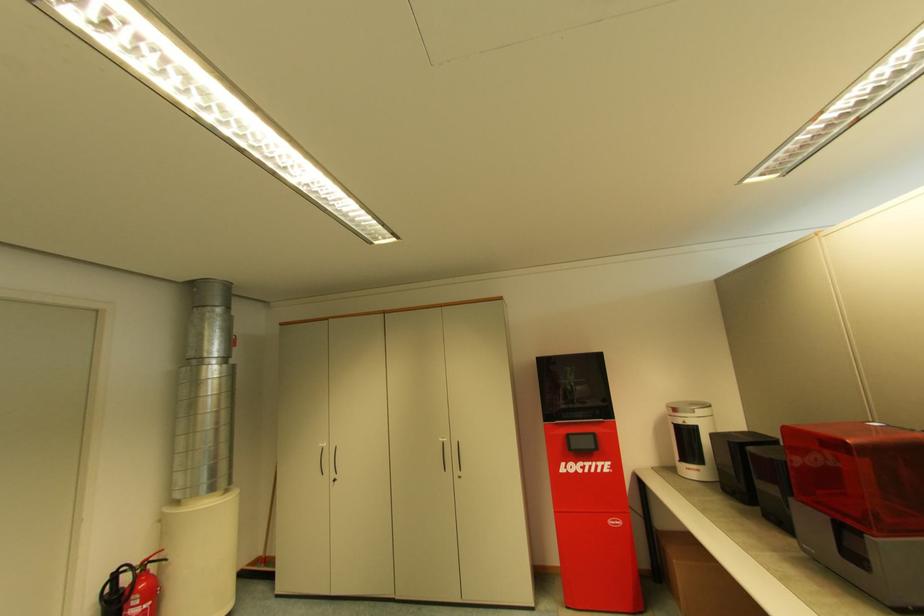
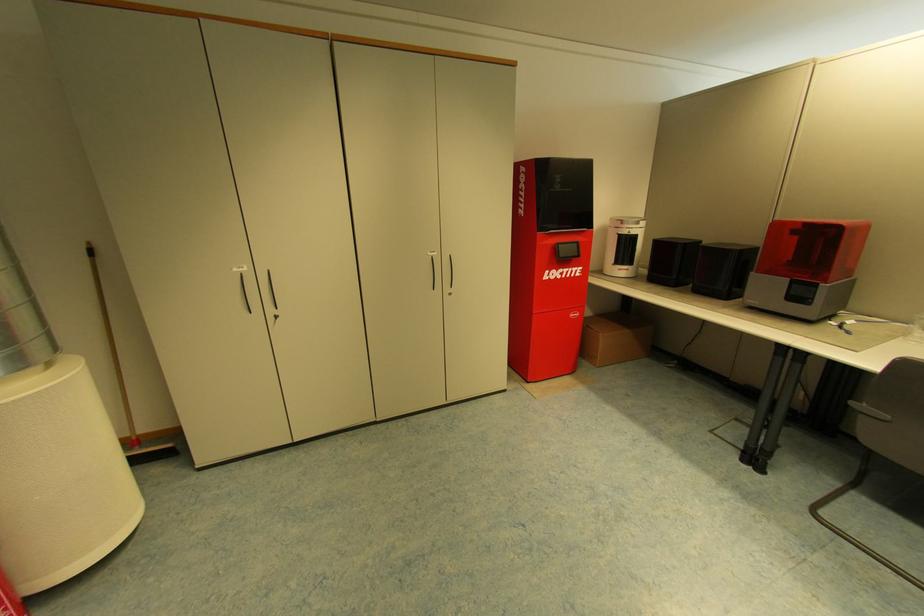
Locate, in the second image, the point that corresponds to pixel 700 427 in the first image.

(640, 236)